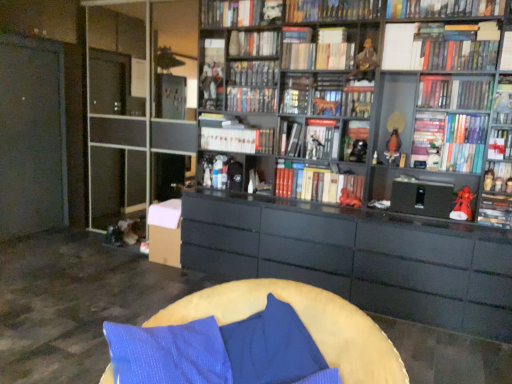
The image size is (512, 384). I want to click on vacant area on top of hardcover book at right, which is the 19th book in top-to-bottom order (from a real-world perspective), so click(x=498, y=193).